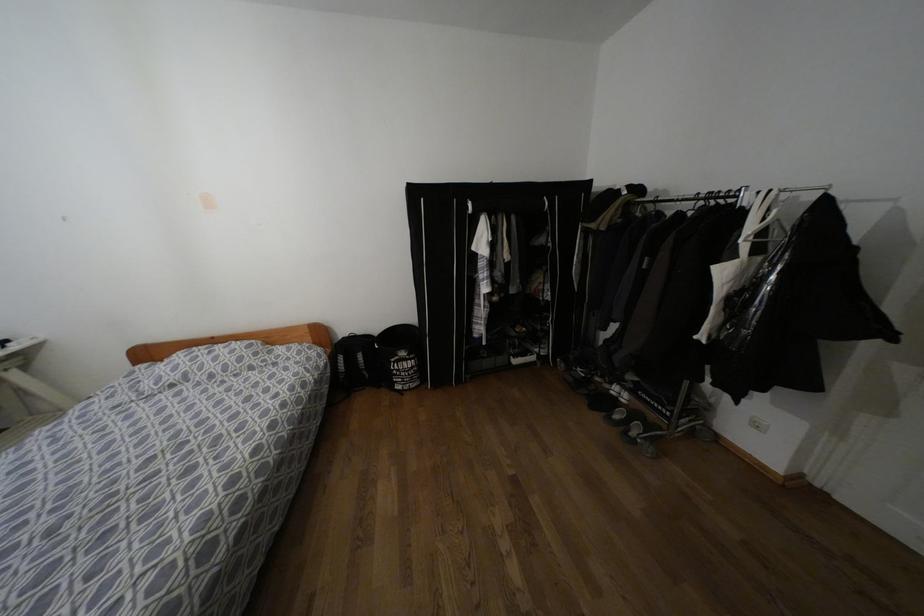
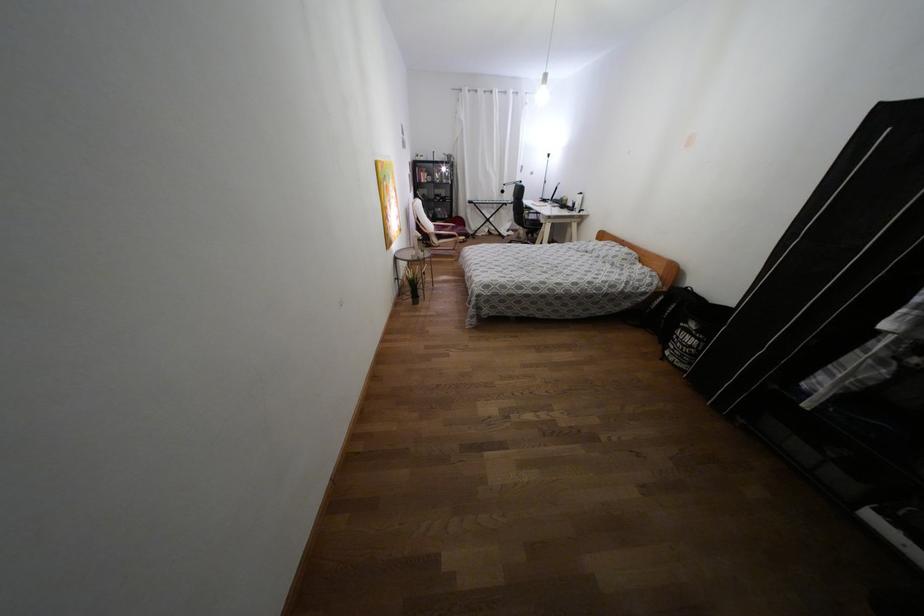
Find the pixel in the second image that matches (397,370) in the first image.

(676, 337)